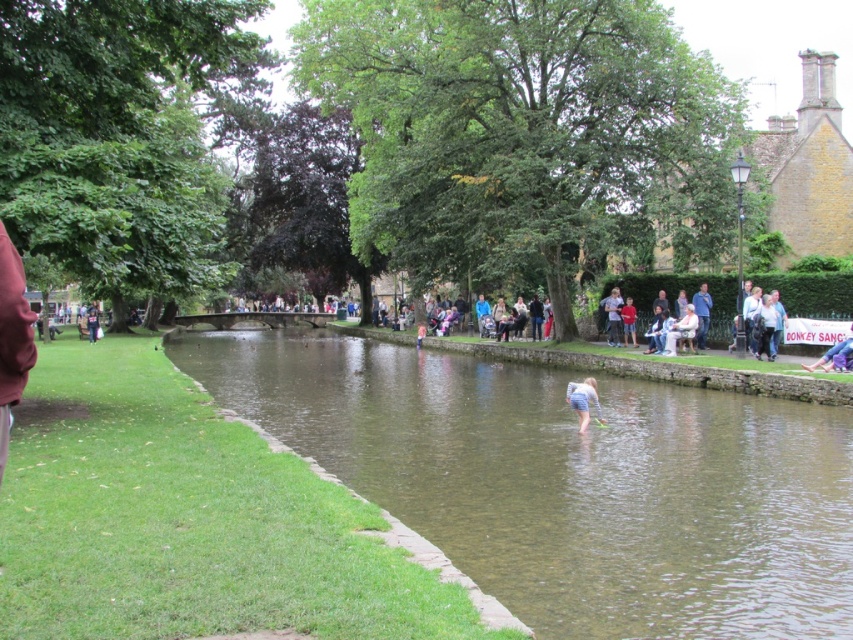
Where is `blue denim shorts at lower center`? This screenshot has height=640, width=853. blue denim shorts at lower center is located at coordinates (583, 401).

Which of these two, blue denim shorts at lower center or light blue denim shorts at center, stands shorter?

Standing shorter between the two is blue denim shorts at lower center.

The width and height of the screenshot is (853, 640). Describe the element at coordinates (583, 401) in the screenshot. I see `blue denim shorts at lower center` at that location.

This screenshot has width=853, height=640. Find the location of `blue denim shorts at lower center`. blue denim shorts at lower center is located at coordinates (583, 401).

Which is more to the right, clear water at center or blue denim shorts at center?

blue denim shorts at center is more to the right.

Can you confirm if clear water at center is positioned below blue denim shorts at center?

Yes.

What do you see at coordinates (570, 481) in the screenshot? I see `clear water at center` at bounding box center [570, 481].

Locate an element on the screen. clear water at center is located at coordinates click(570, 481).

Between clear water at center and light blue denim shorts at center, which one appears on the left side from the viewer's perspective?

From the viewer's perspective, clear water at center appears more on the left side.

Is clear water at center positioned in front of light blue denim shorts at center?

Yes, it is in front of light blue denim shorts at center.

Is point (654, 548) positioned after point (612, 307)?

No.

Find the location of a particular element. This screenshot has height=640, width=853. clear water at center is located at coordinates (570, 481).